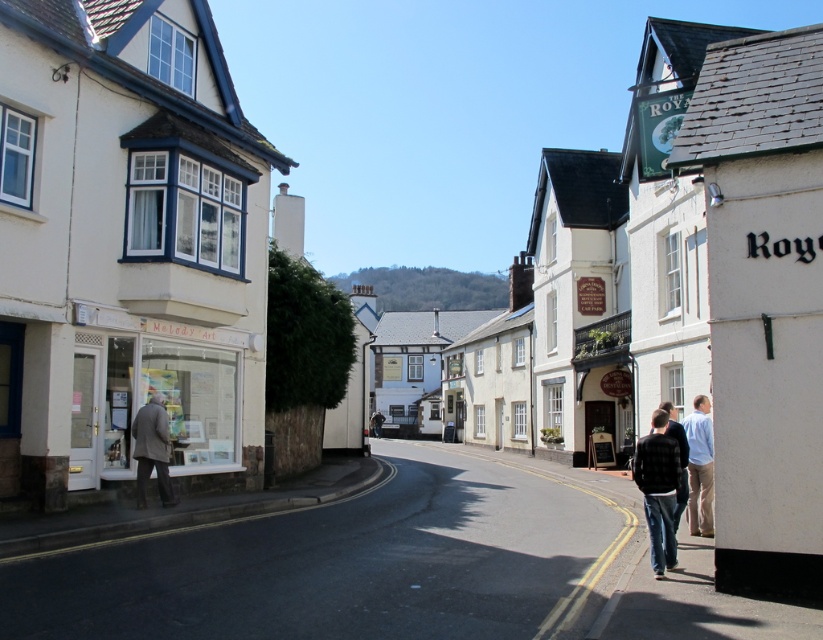
Question: Which of the following is the closest to the observer?

Choices:
 (A) white wooden shop at left
 (B) black flannel shirt at lower right

Answer: (B)

Question: Estimate the real-world distances between objects in this image. Which object is farther from the light blue shirt at right?

Choices:
 (A) white wooden shop at left
 (B) black flannel shirt at lower right

Answer: (A)

Question: Is light blue shirt at right bigger than light brown wool coat at left?

Choices:
 (A) no
 (B) yes

Answer: (B)

Question: Which object is the farthest from the black flannel shirt at lower right?

Choices:
 (A) light blue shirt at right
 (B) light brown wool coat at left
 (C) black textured jacket at lower right

Answer: (B)

Question: Does light brown wool coat at left lie in front of black textured jacket at lower right?

Choices:
 (A) yes
 (B) no

Answer: (B)

Question: Observing the image, what is the correct spatial positioning of white wooden shop at left in reference to black textured jacket at lower right?

Choices:
 (A) above
 (B) below

Answer: (A)